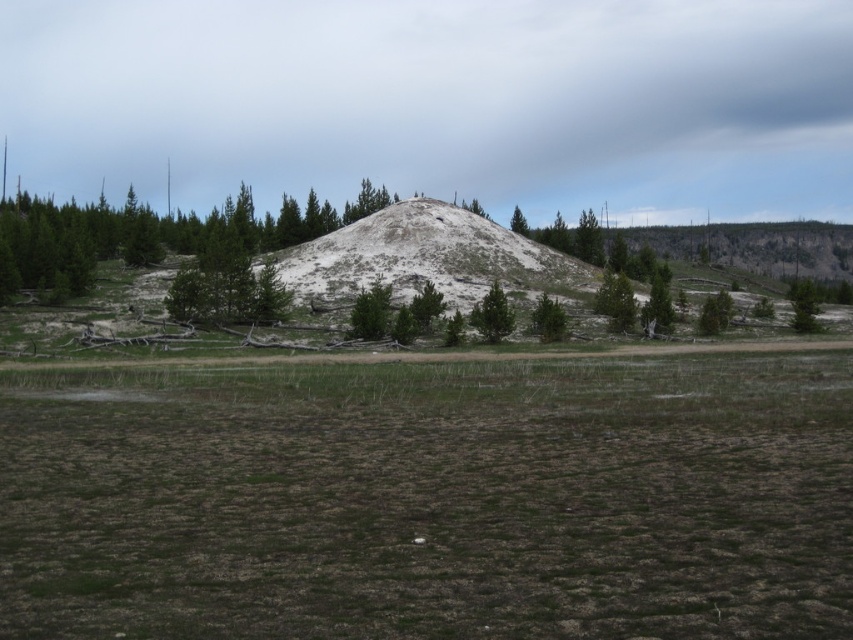
Question: Which object appears farthest from the camera in this image?

Choices:
 (A) green matte tree at center
 (B) green textured pine at left
 (C) green matte tree at upper center
 (D) green grass at center

Answer: (C)

Question: Which object appears closest to the camera in this image?

Choices:
 (A) green matte tree at center
 (B) green matte tree at upper center

Answer: (A)

Question: Is green grass at center closer to the viewer compared to green matte tree at center?

Choices:
 (A) no
 (B) yes

Answer: (B)

Question: Which point is farther to the camera?

Choices:
 (A) (18, 227)
 (B) (483, 330)

Answer: (A)

Question: Is green grass at center smaller than green matte tree at upper center?

Choices:
 (A) no
 (B) yes

Answer: (B)

Question: Is green matte tree at center thinner than green matte tree at upper center?

Choices:
 (A) no
 (B) yes

Answer: (B)